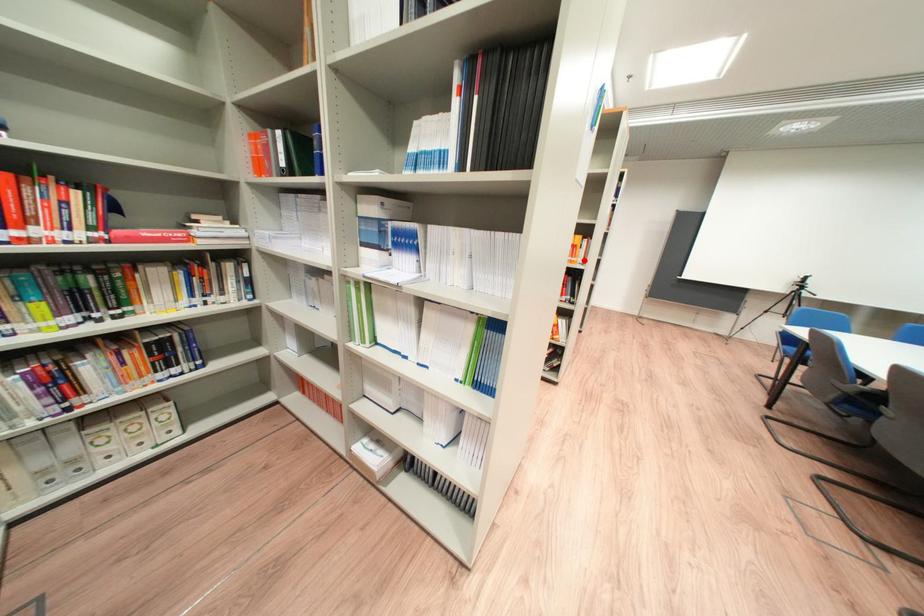
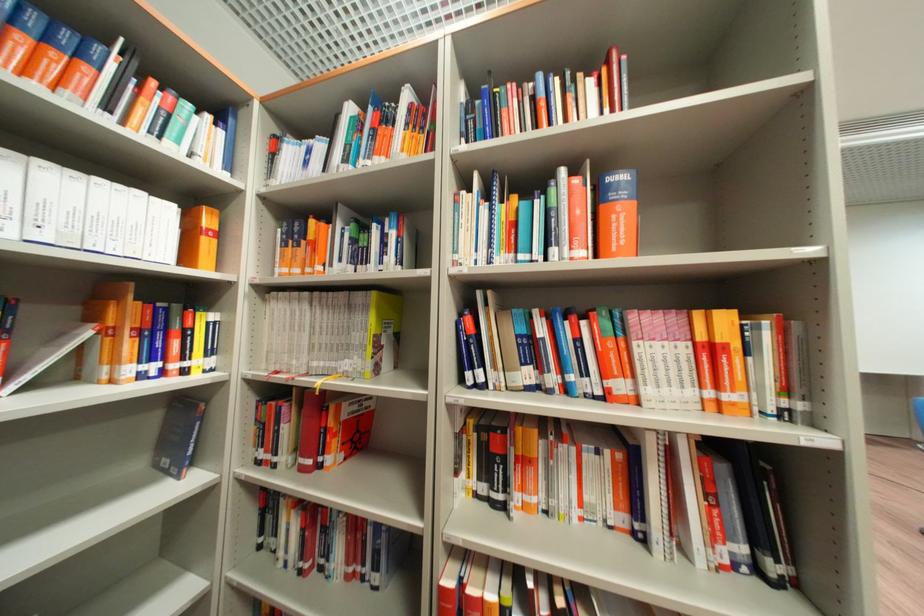
Find the pixel in the second image that matches the highlighted location in the first image.

(739, 398)